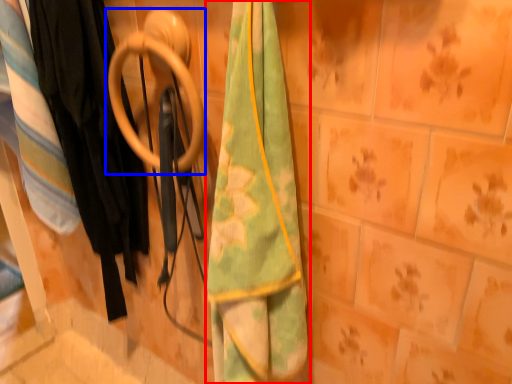
Question: Which of the following is the closest to the observer, towel (highlighted by a red box) or door handle (highlighted by a blue box)?

Choices:
 (A) towel
 (B) door handle

Answer: (A)